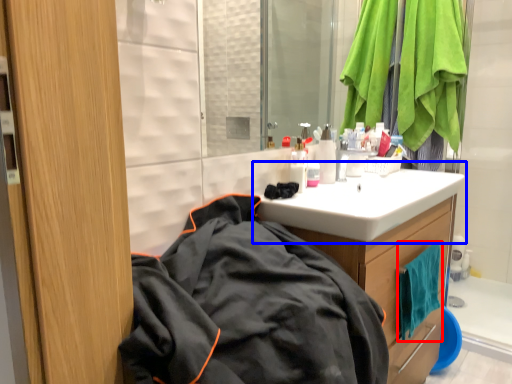
Question: Which point is closer to the camera, beach towel (highlighted by a red box) or sink (highlighted by a blue box)?

Choices:
 (A) beach towel
 (B) sink

Answer: (B)